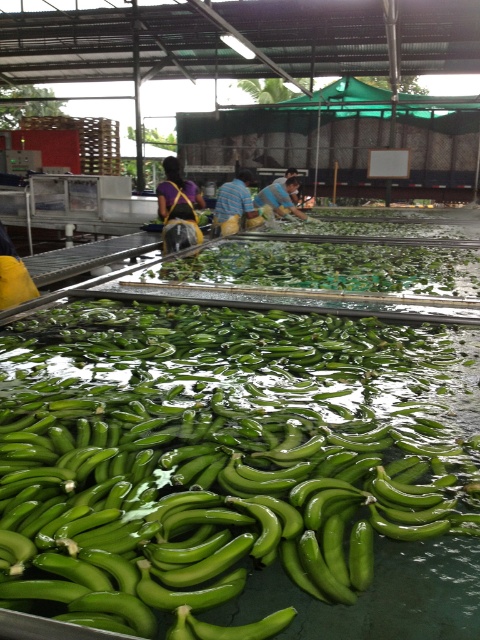
You are a worker in the processing facility and need to locate your blue striped shirt at center. You see the green rubbery bananas at center. In which direction should you move to find your shirt?

The green rubbery bananas at center are to the right of the blue striped shirt at center, so you should move to the left to find your shirt.

From the picture: You are a quality inspector in the banana processing facility. You notice two groups of bananas labeled as green rubber bananas at center and green rubbery bananas at center. According to the spatial arrangement, which group is closer to you?

The green rubber bananas at center is closer to you as it is positioned in front of the green rubbery bananas at center.

You are a quality inspector in the banana processing facility. You need to check if the green rubbery bananas at center are within the required height for export. The minimum height requirement is 15 cm. Can you determine if they meet the requirement using the blue striped shirt at center as a reference?

The green rubbery bananas at center is shorter than blue striped shirt at center. Since the blue striped shirt at center is likely worn by a worker of average height, which is typically around 165 cm, the bananas are significantly shorter and well below the 15 cm requirement. Therefore, they do not meet the height requirement for export.